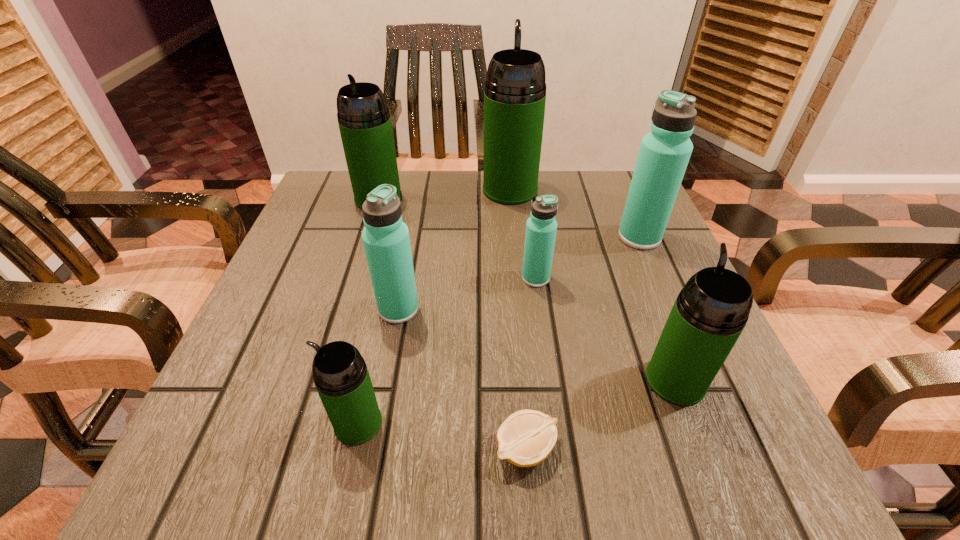
Locate an element on the screen. The width and height of the screenshot is (960, 540). free area in between the second smallest green thermos bottle and the second biggest green thermos bottle is located at coordinates (527, 289).

Identify which object is located as the third nearest to the farthest aqua thermos bottle. Please provide its 2D coordinates. Your answer should be formatted as a tuple, i.e. [(x, y)], where the tuple contains the x and y coordinates of a point satisfying the conditions above.

[(709, 314)]

Locate which object ranks in proximity to the fifth farthest thermos bottle. Please provide its 2D coordinates. Your answer should be formatted as a tuple, i.e. [(x, y)], where the tuple contains the x and y coordinates of a point satisfying the conditions above.

[(341, 377)]

Identify which thermos bottle is the fourth closest to the second smallest green thermos bottle. Please provide its 2D coordinates. Your answer should be formatted as a tuple, i.e. [(x, y)], where the tuple contains the x and y coordinates of a point satisfying the conditions above.

[(341, 377)]

What are the coordinates of `thermos bottle that stands as the fourth closest to the third farthest object` in the screenshot? It's located at (386, 241).

You are a GUI agent. You are given a task and a screenshot of the screen. Output one action in this format:
    pyautogui.click(x=<x>, y=<y>)
    Task: Click on the green thermos bottle that is the third closest to the fourth farthest thermos bottle
    
    Given the screenshot: What is the action you would take?
    pyautogui.click(x=341, y=377)

This screenshot has width=960, height=540. I want to click on the closest green thermos bottle to the fifth nearest object, so click(x=709, y=314).

Locate which aqua thermos bottle ranks in proximity to the second smallest aqua thermos bottle. Please provide its 2D coordinates. Your answer should be formatted as a tuple, i.e. [(x, y)], where the tuple contains the x and y coordinates of a point satisfying the conditions above.

[(541, 227)]

You are a GUI agent. You are given a task and a screenshot of the screen. Output one action in this format:
    pyautogui.click(x=<x>, y=<y>)
    Task: Click on the aqua thermos bottle that is the third closest to the smallest green thermos bottle
    This screenshot has height=540, width=960.
    Given the screenshot: What is the action you would take?
    coord(664,153)

Find the location of a particular element. This screenshot has height=540, width=960. free point that satisfies the following two spatial constraints: 1. from the spout of the third smallest green thermos bottle; 2. on the right side of the biggest aqua thermos bottle is located at coordinates (367, 237).